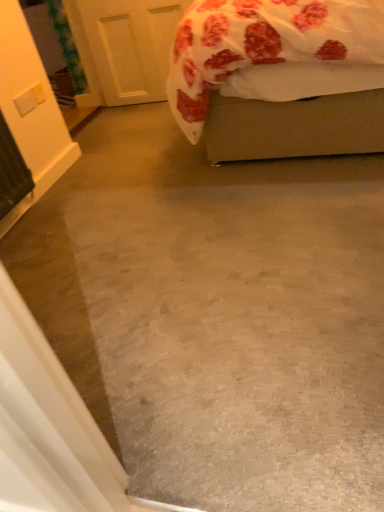
Where is `free space to the left of fluffy white bed at upper right`? free space to the left of fluffy white bed at upper right is located at coordinates (122, 175).